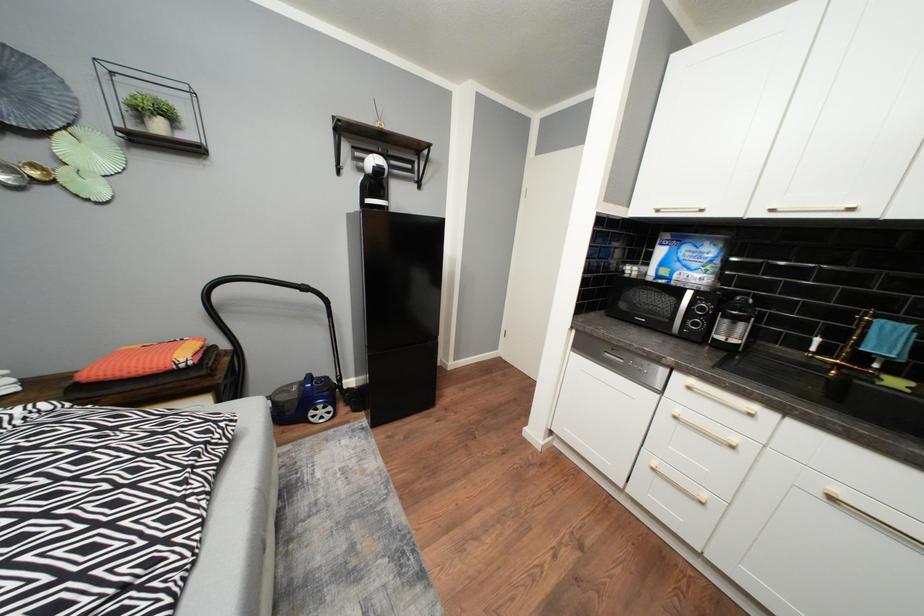
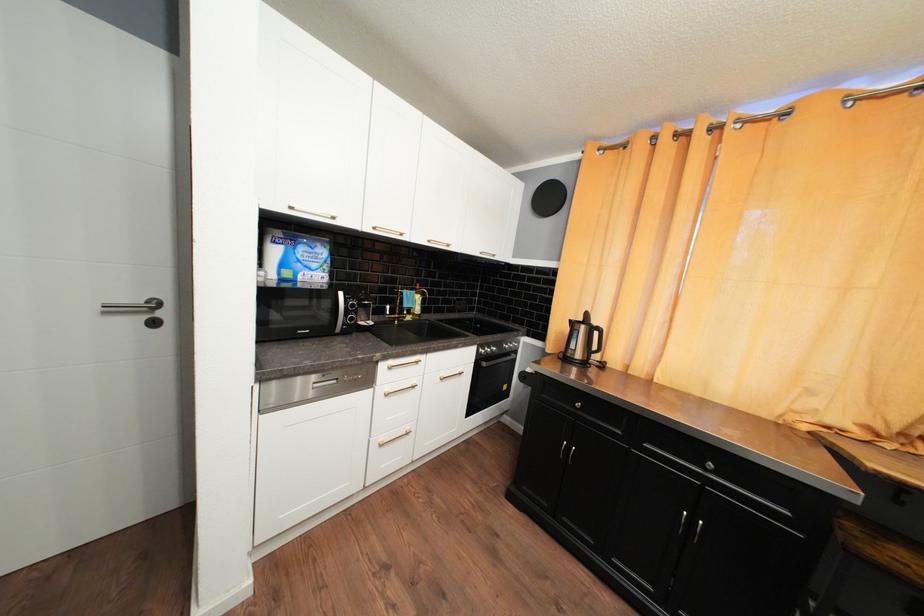
The images are taken continuously from a first-person perspective. In which direction is your viewpoint rotating?

The camera's rotation is toward right-down.